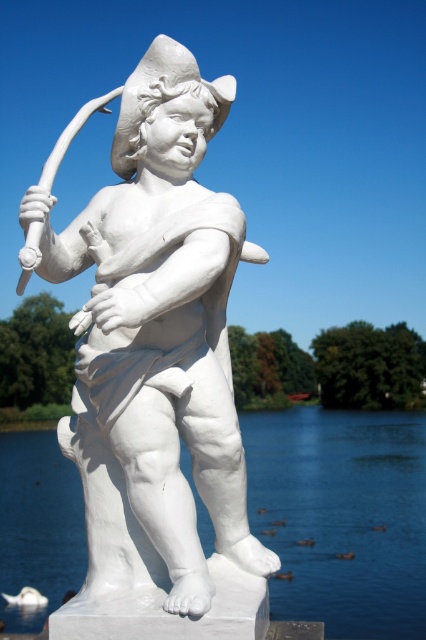
You are an art student analyzing the sculpture in the image. The white marble statue at center and transparent water at statue right are both part of the scene. Which object is significantly taller?

The white marble statue at center is much taller than the transparent water at statue right.

In the scene shown: You are an art student trying to sketch the scene. You want to ensure the spatial relationship between the white marble statue at center and the transparent water at statue right is accurate. Which object should you draw first to establish depth?

You should draw the white marble statue at center first because it is closer to the viewer than the transparent water at statue right, so it should appear in front in the sketch.

You are standing in the outdoor area where the white stone statue of a cherub is located. You want to take a photo of the statue while standing at the point with coordinates point (x=158, y=344). Will you be able to see the statue clearly in your photo?

The point (x=158, y=344) indicates the white marble statue at center, so standing there would place you directly at the statue. You won